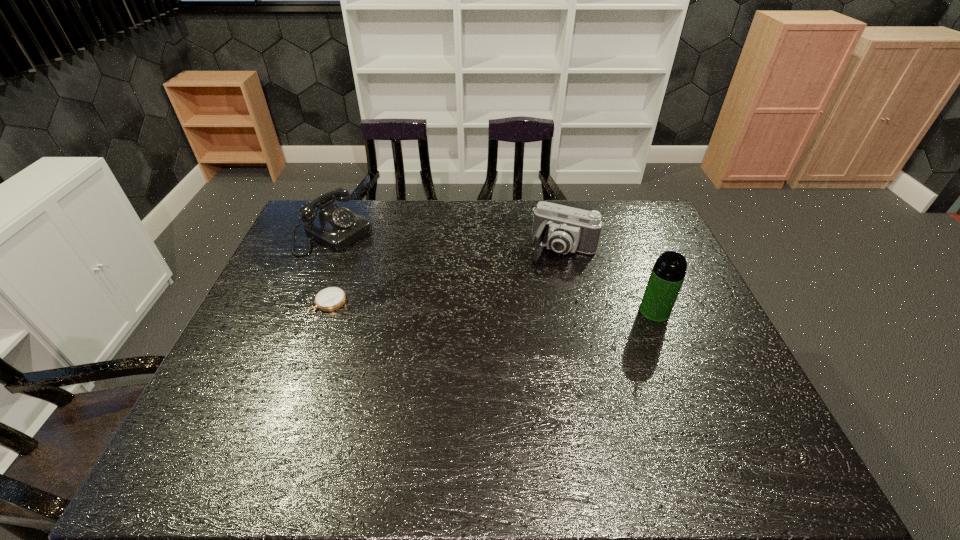
Where is `compass`? The height and width of the screenshot is (540, 960). compass is located at coordinates (329, 299).

Locate an element on the screen. thermos bottle is located at coordinates (668, 273).

Where is `the tallest object`? the tallest object is located at coordinates (668, 273).

Identify the location of camera. The width and height of the screenshot is (960, 540). (563, 229).

This screenshot has width=960, height=540. I want to click on telephone, so click(335, 227).

The height and width of the screenshot is (540, 960). Identify the location of vacant space situated 0.370m on the back of the shortest object. (358, 219).

Locate an element on the screen. Image resolution: width=960 pixels, height=540 pixels. free point located 0.130m from the spout of the tallest object is located at coordinates (675, 361).

Where is `free space located at the front of the third object from left to right with an open lens cover`? The width and height of the screenshot is (960, 540). free space located at the front of the third object from left to right with an open lens cover is located at coordinates (541, 291).

Find the location of a particular element. The image size is (960, 540). free space located at the front of the third object from left to right with an open lens cover is located at coordinates (547, 278).

You are a GUI agent. You are given a task and a screenshot of the screen. Output one action in this format:
    pyautogui.click(x=<x>, y=<y>)
    Task: Click on the vacant region located 0.070m at the front of the third object from left to right with an open lens cover
    The height and width of the screenshot is (540, 960).
    Given the screenshot: What is the action you would take?
    pyautogui.click(x=547, y=278)